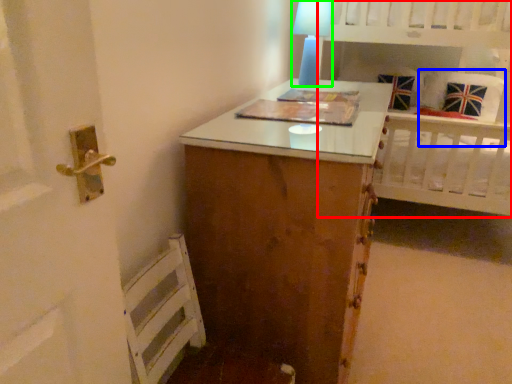
Question: Which object is positioned farthest from bed (highlighted by a red box)? Select from pillow (highlighted by a blue box) and table lamp (highlighted by a green box).

Choices:
 (A) pillow
 (B) table lamp

Answer: (B)